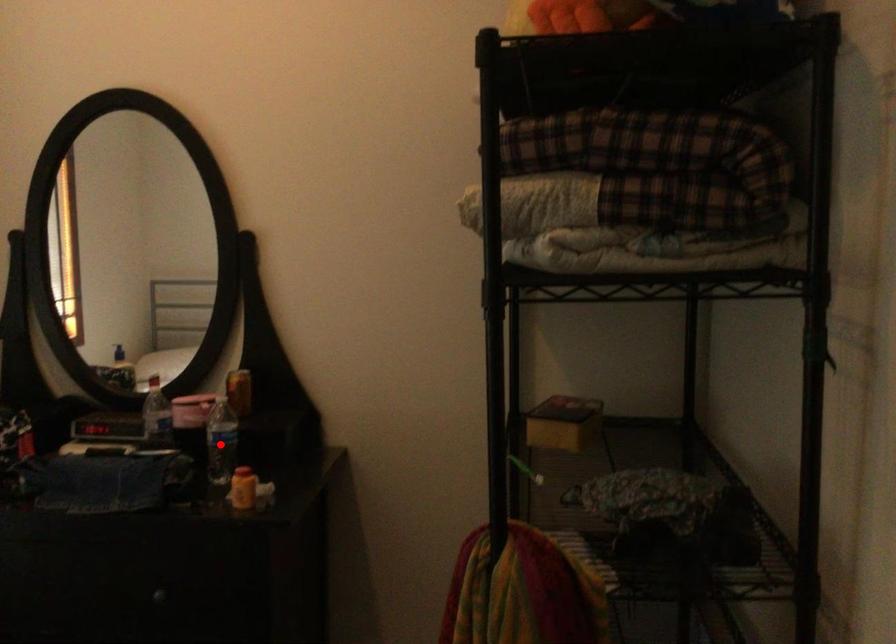
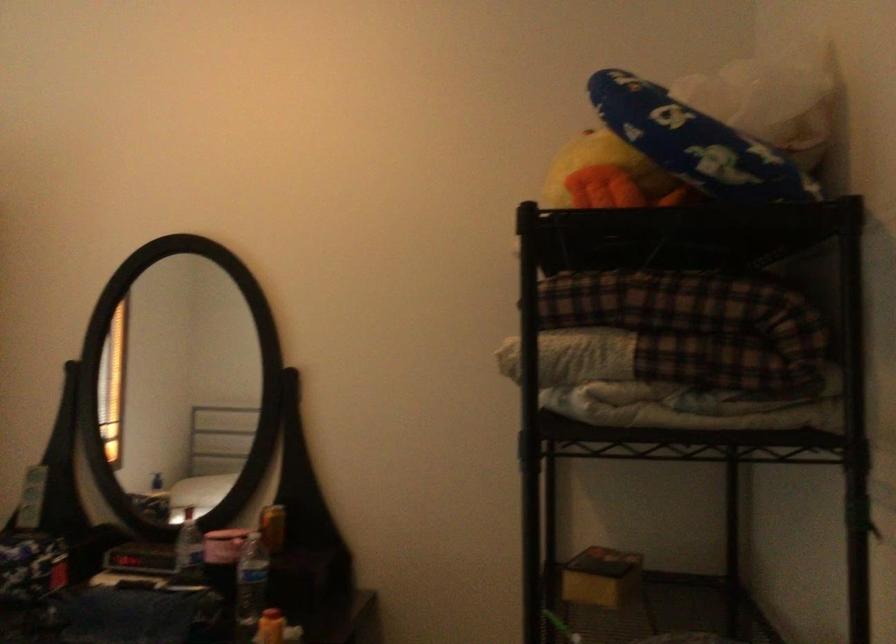
Find the pixel in the second image that matches the highlighted location in the first image.

(250, 585)